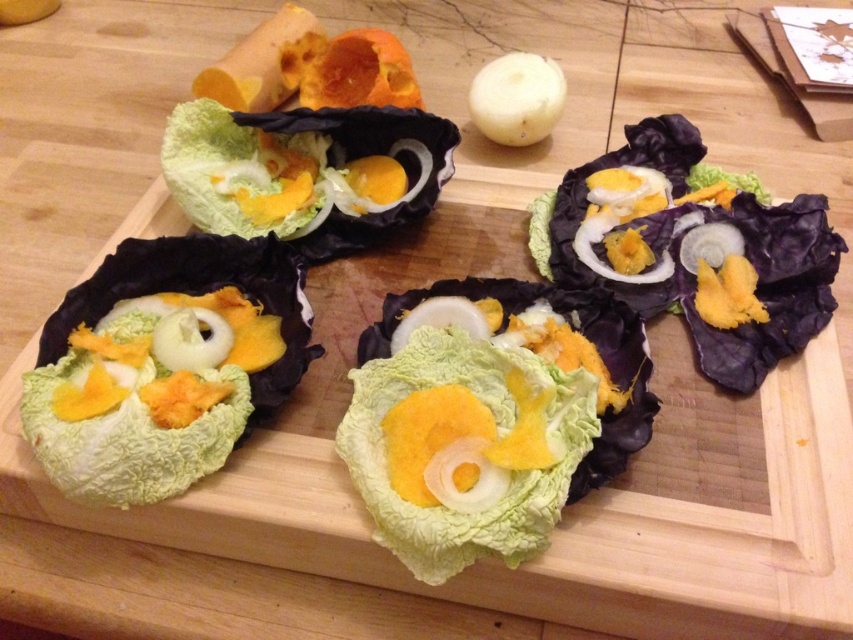
You are a chef arranging ingredients on a table. You have a purple matte cabbage leaf at upper right and a green leafy lettuce at center. Which of these two leaves is taller?

The purple matte cabbage leaf at upper right is taller than the green leafy lettuce at center.

You are a chef arranging ingredients on a table. You have a green leafy lettuce at center and a green leafy cabbage at upper left. Which ingredient is closer to the viewer?

The green leafy cabbage at upper left is closer to the viewer because it is positioned above the green leafy lettuce at center.

Looking at this image, you are a chef arranging ingredients on a table and need to place a new ingredient between the two points labeled point (755, 276) and point (387, 387). Which point should you place it closer to so that it remains in the foreground?

You should place the new ingredient closer to point (755, 276) because it is closer to the viewer compared to point (387, 387), ensuring the ingredient stays in the foreground.